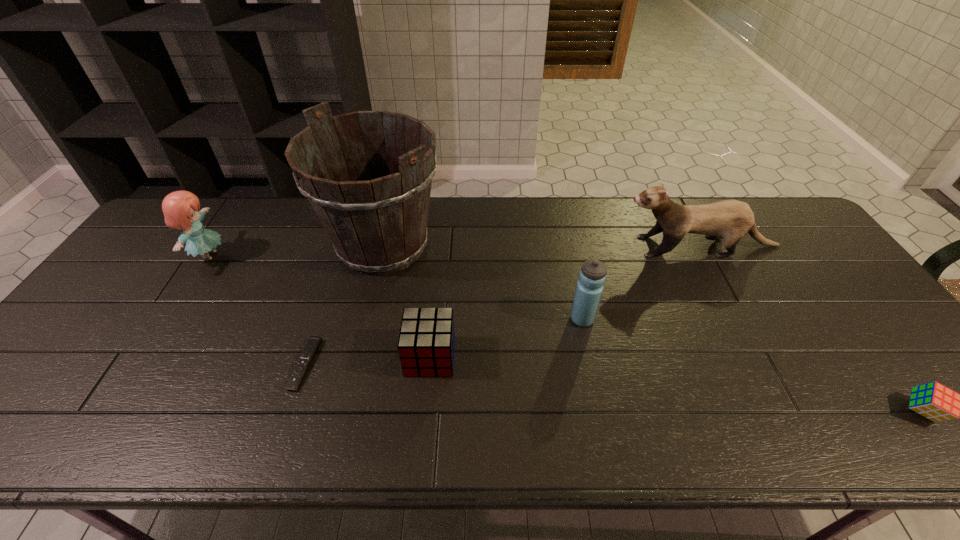
Where is `bucket`? bucket is located at coordinates click(376, 227).

Locate an element on the screen. The height and width of the screenshot is (540, 960). doll is located at coordinates (180, 208).

Identify the location of ferret. (730, 220).

Where is `the fourth farthest object`? the fourth farthest object is located at coordinates (592, 276).

This screenshot has height=540, width=960. I want to click on water bottle, so pyautogui.click(x=592, y=276).

Identify the location of the farther cube. (426, 343).

Find the location of a particular element. The width and height of the screenshot is (960, 540). the third shortest object is located at coordinates (426, 343).

Where is `the nearer cube`? The height and width of the screenshot is (540, 960). the nearer cube is located at coordinates (933, 400).

I want to click on the second shortest object, so click(x=933, y=400).

The width and height of the screenshot is (960, 540). Find the location of `remote control`. remote control is located at coordinates (309, 351).